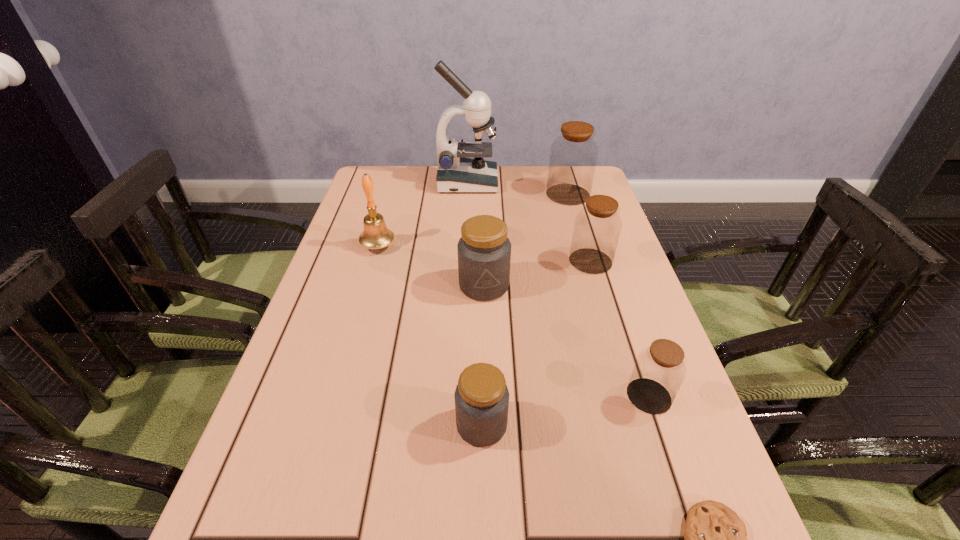
Image resolution: width=960 pixels, height=540 pixels. I want to click on object at the left edge, so click(x=375, y=235).

I want to click on object situated at the far right corner, so click(x=573, y=156).

In the image, there is a desktop. Where is `vacant region at the far edge`? vacant region at the far edge is located at coordinates (532, 176).

Locate an element on the screen. This screenshot has height=540, width=960. vacant space at the left edge of the desktop is located at coordinates (353, 237).

This screenshot has width=960, height=540. What are the coordinates of `free space at the right edge of the desktop` in the screenshot? It's located at (691, 414).

Where is `free location at the far left corner`? free location at the far left corner is located at coordinates (400, 172).

The image size is (960, 540). I want to click on empty location between the biggest brown jar and the farther gray jar, so click(x=526, y=240).

You are a GUI agent. You are given a task and a screenshot of the screen. Output one action in this format:
    pyautogui.click(x=<x>, y=<y>)
    Task: Click on the free point between the second biggest brown jar and the gray microscope
    This screenshot has width=960, height=540.
    Given the screenshot: What is the action you would take?
    pyautogui.click(x=529, y=222)

I want to click on free space between the second smallest brown jar and the microscope, so click(529, 222).

Where is `empty space between the tallest object and the nearer gray jar`? This screenshot has height=540, width=960. empty space between the tallest object and the nearer gray jar is located at coordinates (474, 303).